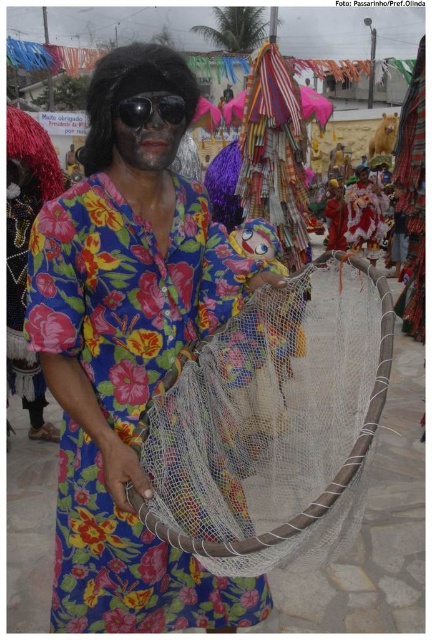
Question: Among these points, which one is farthest from the camera?

Choices:
 (A) (81, 465)
 (B) (133, 104)
 (C) (372, 195)
 (D) (99, 120)

Answer: (C)

Question: Is floral fabric dress at center closer to camera compared to velvet red mask at upper right?

Choices:
 (A) no
 (B) yes

Answer: (B)

Question: Which object appears closest to the camera in this image?

Choices:
 (A) white mesh net at center
 (B) black reflective sunglasses at center
 (C) floral fabric dress at center

Answer: (A)

Question: Can you confirm if black synthetic wig at upper left is positioned below black reflective sunglasses at center?

Choices:
 (A) no
 (B) yes

Answer: (A)

Question: Which object is the closest to the black reflective sunglasses at center?

Choices:
 (A) floral fabric dress at center
 (B) white mesh net at center
 (C) black synthetic wig at upper left
 (D) velvet red mask at upper right

Answer: (C)

Question: Can you confirm if floral fabric dress at center is thinner than black synthetic wig at upper left?

Choices:
 (A) yes
 (B) no

Answer: (A)